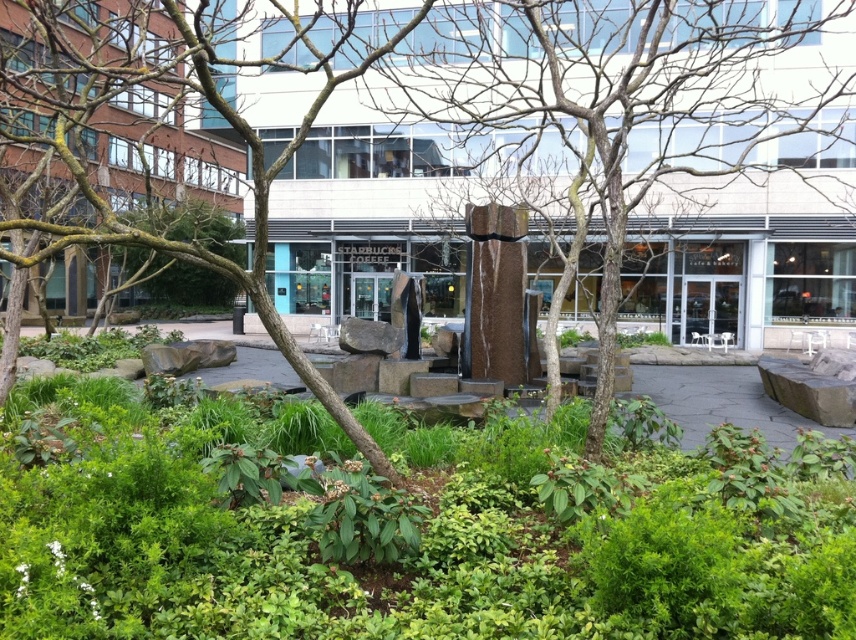
Can you confirm if brown stone fountain at center is thinner than polished bronze statue at center?

Incorrect, brown stone fountain at center's width is not less than polished bronze statue at center's.

Does brown stone fountain at center have a greater height compared to polished bronze statue at center?

Indeed, brown stone fountain at center has a greater height compared to polished bronze statue at center.

Image resolution: width=856 pixels, height=640 pixels. In order to click on brown stone fountain at center in this screenshot , I will do `click(494, 292)`.

Can you confirm if bare branches at center is thinner than smooth bark tree at lower left?

No, bare branches at center is not thinner than smooth bark tree at lower left.

Where is `bare branches at center`? The width and height of the screenshot is (856, 640). bare branches at center is located at coordinates (608, 113).

Does bare branches at center appear under polished bronze statue at center?

Incorrect, bare branches at center is not positioned below polished bronze statue at center.

Who is more forward, (x=599, y=99) or (x=403, y=314)?

Point (x=403, y=314) is in front.

Locate an element on the screen. This screenshot has width=856, height=640. bare branches at center is located at coordinates (608, 113).